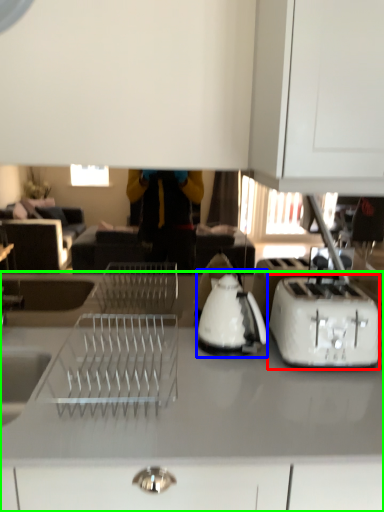
Question: Based on their relative distances, which object is farther from toaster (highlighted by a red box)? Choose from kettle (highlighted by a blue box) and countertop (highlighted by a green box).

Choices:
 (A) kettle
 (B) countertop

Answer: (B)